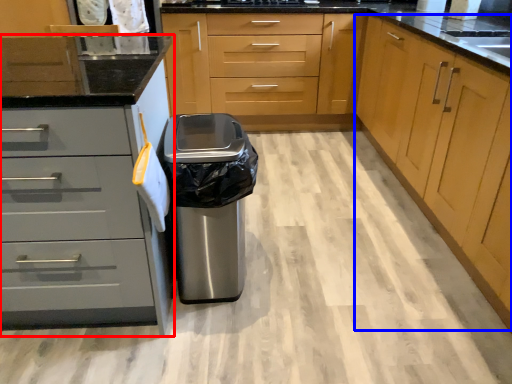
Question: Which object appears farthest to the camera in this image, cabinetry (highlighted by a red box) or cabinetry (highlighted by a blue box)?

Choices:
 (A) cabinetry
 (B) cabinetry

Answer: (A)